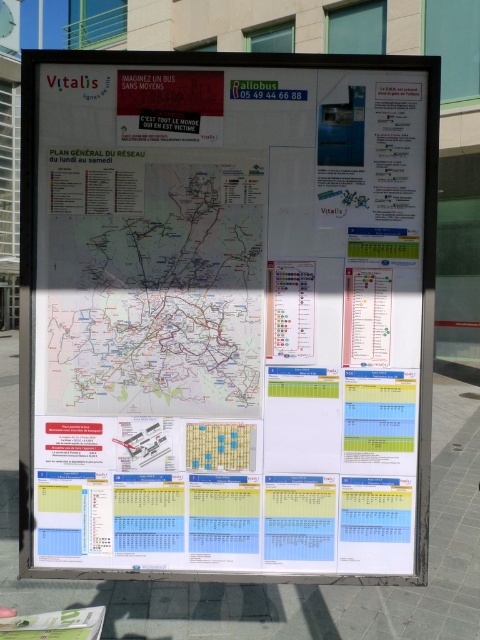
You are standing in front of the public transportation board and want to touch the point labeled as point [368,326]. Can you reach it without moving your hand more than 2 meters from your body? Please explain your reasoning.

The point [368,326] is 2.14 meters away from the camera. Since this distance exceeds 2 meters, you cannot reach it without moving your hand more than 2 meters from your body.